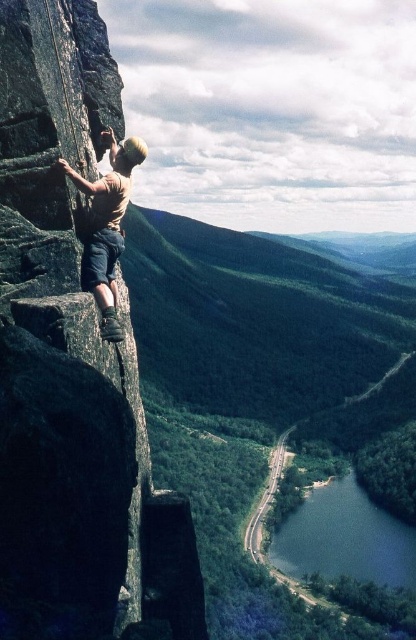
Question: Can you confirm if smooth gray rock at left is bigger than light brown fabric shirt at left?

Choices:
 (A) yes
 (B) no

Answer: (A)

Question: Does smooth gray rock at left lie in front of light brown fabric shirt at left?

Choices:
 (A) no
 (B) yes

Answer: (B)

Question: Which of the following is the farthest from the observer?

Choices:
 (A) light brown fabric shirt at left
 (B) smooth gray rock at left

Answer: (A)

Question: Does smooth gray rock at left appear on the right side of light brown fabric shirt at left?

Choices:
 (A) yes
 (B) no

Answer: (A)

Question: Which point appears closest to the camera in this image?

Choices:
 (A) (116, 216)
 (B) (84, 486)

Answer: (B)